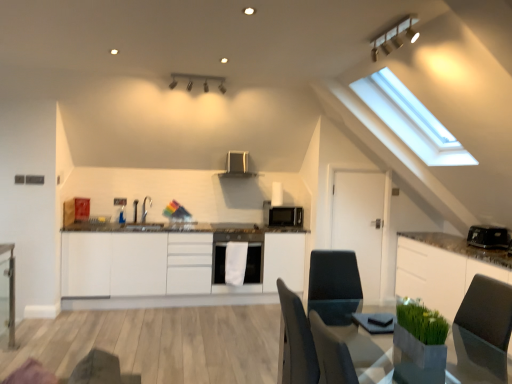
Question: From a real-world perspective, is white matte cabinetry at center, which is counted as the first cabinetry, starting from the left, positioned over matte silver light fixture at upper center, which is the 2th light fixture from back to front, based on gravity?

Choices:
 (A) no
 (B) yes

Answer: (A)

Question: Considering the relative positions of white matte cabinetry at center, acting as the 2th cabinetry starting from the right, and matte silver light fixture at upper center, which ranks as the 1th light fixture in front-to-back order, in the image provided, is white matte cabinetry at center, acting as the 2th cabinetry starting from the right, to the left of matte silver light fixture at upper center, which ranks as the 1th light fixture in front-to-back order, from the viewer's perspective?

Choices:
 (A) no
 (B) yes

Answer: (B)

Question: Can you confirm if white matte cabinetry at center, acting as the 2th cabinetry starting from the right, is taller than matte silver light fixture at upper center, which ranks as the 1th light fixture in front-to-back order?

Choices:
 (A) yes
 (B) no

Answer: (A)

Question: Does white matte cabinetry at center, acting as the 2th cabinetry starting from the right, have a lesser height compared to matte silver light fixture at upper center, arranged as the first light fixture when viewed from the right?

Choices:
 (A) yes
 (B) no

Answer: (B)

Question: Is white matte cabinetry at center, which is counted as the first cabinetry, starting from the left, turned away from matte silver light fixture at upper center, arranged as the first light fixture when viewed from the right?

Choices:
 (A) no
 (B) yes

Answer: (A)

Question: Is white matte dishwasher at center bigger or smaller than white glossy cabinet at right, which is the 1th cabinetry from right to left?

Choices:
 (A) big
 (B) small

Answer: (B)

Question: From a real-world perspective, is white matte dishwasher at center above or below white glossy cabinet at right, which is the 1th cabinetry from right to left?

Choices:
 (A) above
 (B) below

Answer: (A)

Question: From their relative heights in the image, would you say white matte dishwasher at center is taller or shorter than white glossy cabinet at right, marked as the second cabinetry in a left-to-right arrangement?

Choices:
 (A) tall
 (B) short

Answer: (B)

Question: Is white matte dishwasher at center in front of or behind white glossy cabinet at right, marked as the second cabinetry in a left-to-right arrangement, in the image?

Choices:
 (A) front
 (B) behind

Answer: (B)

Question: Do you think clear glass table at left, marked as the 2th table in a front-to-back arrangement, is within white matte dishwasher at center, or outside of it?

Choices:
 (A) outside
 (B) inside

Answer: (A)

Question: Considering their positions, is clear glass table at left, which appears as the 1th table when viewed from the left, located in front of or behind white matte dishwasher at center?

Choices:
 (A) behind
 (B) front

Answer: (B)

Question: In the image, is clear glass table at left, marked as the 2th table in a front-to-back arrangement, on the left side or the right side of white matte dishwasher at center?

Choices:
 (A) right
 (B) left

Answer: (B)

Question: Is point (9, 339) positioned closer to the camera than point (218, 281)?

Choices:
 (A) closer
 (B) farther

Answer: (A)

Question: From a real-world perspective, relative to black matte microwave at center, is smooth gray table at lower right, acting as the 1th table starting from the front, vertically above or below?

Choices:
 (A) below
 (B) above

Answer: (A)

Question: Is smooth gray table at lower right, the second table viewed from the left, spatially inside black matte microwave at center, or outside of it?

Choices:
 (A) outside
 (B) inside

Answer: (A)